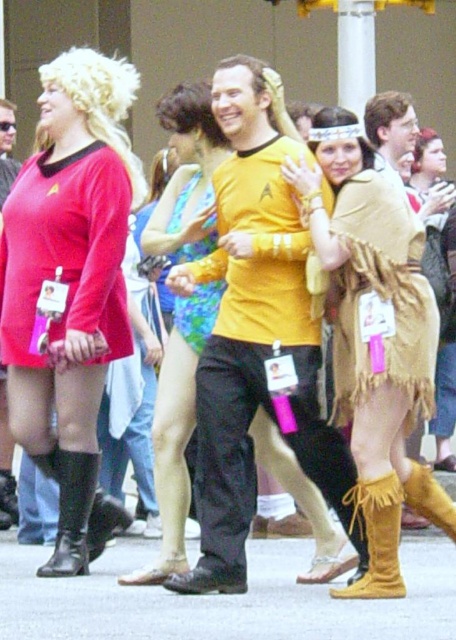
Question: Which object appears closest to the camera in this image?

Choices:
 (A) matte red dress at center
 (B) tan woven cape at center
 (C) fuzzy brown blanket at center
 (D) matte red uniform at left

Answer: (C)

Question: Based on their relative distances, which object is nearer to the black leather boot at lower left?

Choices:
 (A) tan woven cape at center
 (B) fuzzy brown blanket at center
 (C) tan suede skirt at center

Answer: (C)

Question: In this image, where is yellow matte shirt at center located relative to tan woven cape at center?

Choices:
 (A) below
 (B) above

Answer: (A)

Question: Which of the following is the closest to the observer?

Choices:
 (A) (76, 472)
 (B) (61, 547)

Answer: (B)

Question: Is tan suede skirt at center smaller than fuzzy brown blanket at center?

Choices:
 (A) yes
 (B) no

Answer: (B)

Question: Does yellow matte shirt at center appear on the right side of tan woven cape at center?

Choices:
 (A) yes
 (B) no

Answer: (B)